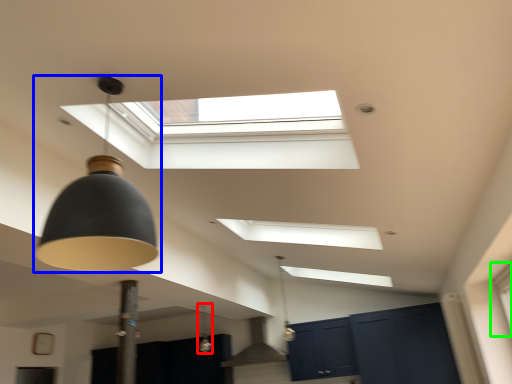
Question: Considering the real-world distances, which object is farthest from lamp (highlighted by a red box)? lamp (highlighted by a blue box) or window (highlighted by a green box)?

Choices:
 (A) lamp
 (B) window

Answer: (A)